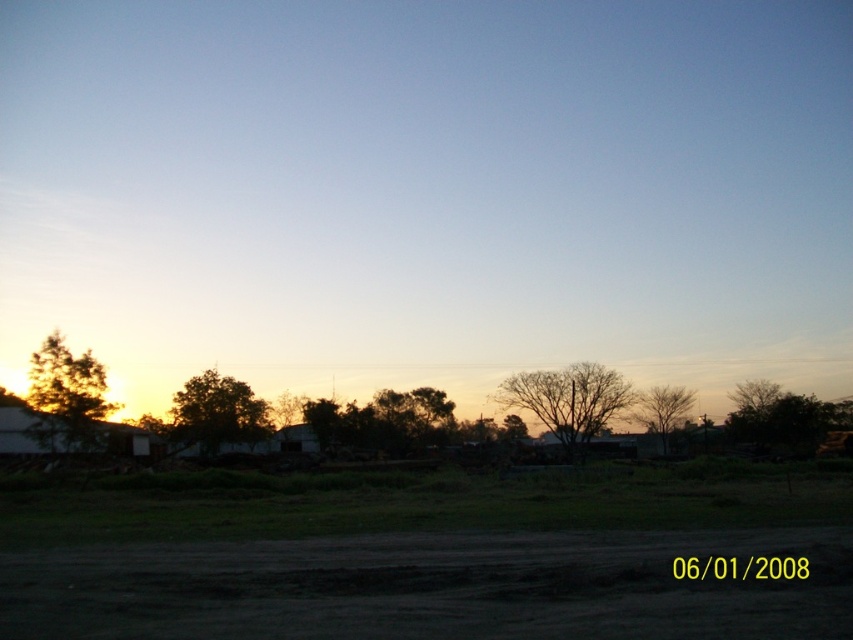
Which is more to the left, green leafy tree at left or bare branches at center?

green leafy tree at left

Which is in front, point (55, 413) or point (602, 385)?

Point (55, 413)

This screenshot has height=640, width=853. I want to click on green leafy tree at left, so click(x=67, y=397).

Is point (78, 406) positioned behind point (631, 419)?

That is False.

In the scene shown: Does green leafy tree at left have a larger size compared to brown leafless tree at center-right?

Incorrect, green leafy tree at left is not larger than brown leafless tree at center-right.

Which is behind, point (62, 355) or point (639, 396)?

Point (639, 396)

I want to click on green leafy tree at left, so click(x=67, y=397).

Is point (759, 419) closer to camera compared to point (223, 403)?

That is False.

Is green leafy tree at right to the right of green leafy tree at center from the viewer's perspective?

Yes, green leafy tree at right is to the right of green leafy tree at center.

At what (x,y) coordinates should I click in order to perform the action: click on green leafy tree at right. Please return your answer as a coordinate pair (x, y). Looking at the image, I should click on (786, 419).